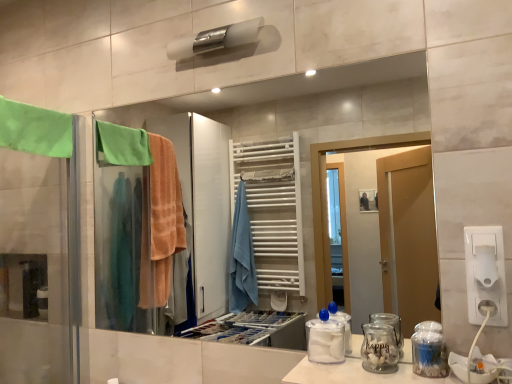
Question: Considering the relative positions of white plastic socket at lower right and transparent plastic container at center in the image provided, is white plastic socket at lower right behind transparent plastic container at center?

Choices:
 (A) yes
 (B) no

Answer: (B)

Question: Is white plastic socket at lower right shorter than transparent plastic container at center?

Choices:
 (A) no
 (B) yes

Answer: (A)

Question: Is white plastic socket at lower right taller than transparent plastic container at center?

Choices:
 (A) yes
 (B) no

Answer: (A)

Question: From the image's perspective, is white plastic socket at lower right over transparent plastic container at center?

Choices:
 (A) no
 (B) yes

Answer: (B)

Question: Is white plastic socket at lower right in front of transparent plastic container at center?

Choices:
 (A) yes
 (B) no

Answer: (A)

Question: Can you confirm if white plastic socket at lower right is thinner than transparent plastic container at center?

Choices:
 (A) no
 (B) yes

Answer: (B)

Question: Can you confirm if white plastic toilet paper at right is wider than green fabric towel at left?

Choices:
 (A) yes
 (B) no

Answer: (B)

Question: From a real-world perspective, is white plastic toilet paper at right beneath green fabric towel at left?

Choices:
 (A) no
 (B) yes

Answer: (B)

Question: From a real-world perspective, is white plastic toilet paper at right on green fabric towel at left?

Choices:
 (A) yes
 (B) no

Answer: (B)

Question: Does white plastic toilet paper at right have a larger size compared to green fabric towel at left?

Choices:
 (A) yes
 (B) no

Answer: (B)

Question: Considering the relative sizes of white plastic toilet paper at right and green fabric towel at left in the image provided, is white plastic toilet paper at right thinner than green fabric towel at left?

Choices:
 (A) no
 (B) yes

Answer: (B)

Question: Is white plastic toilet paper at right shorter than green fabric towel at left?

Choices:
 (A) yes
 (B) no

Answer: (A)

Question: Does transparent plastic container at center have a lesser width compared to clear plastic jar at lower right, positioned as the first glass jar in right-to-left order?

Choices:
 (A) no
 (B) yes

Answer: (A)